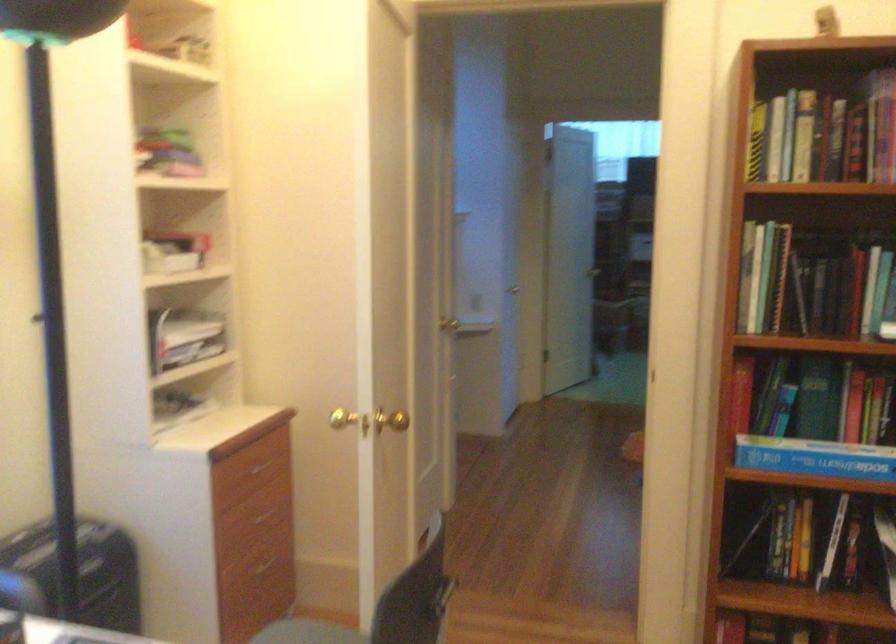
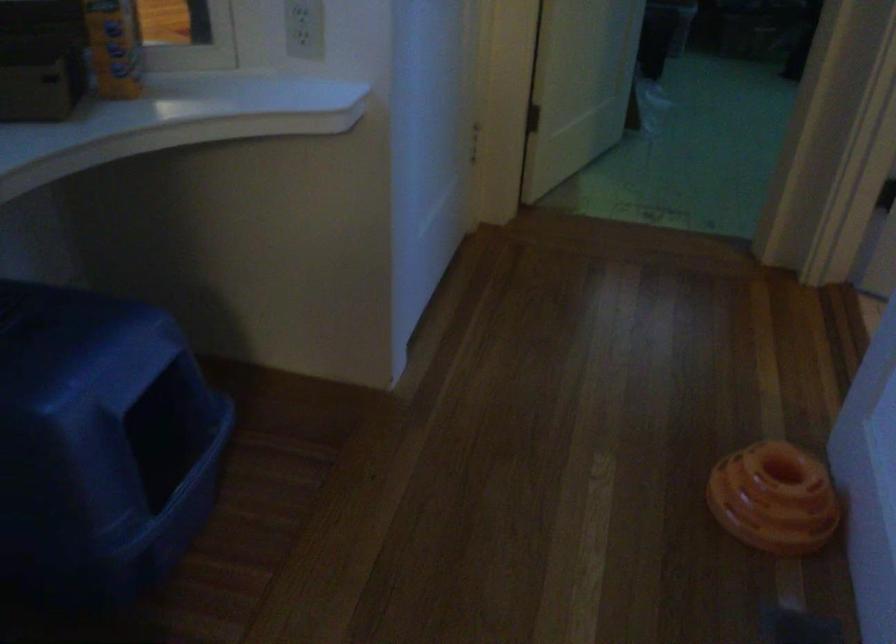
Question: In a continuous first-person perspective shot, in which direction is the camera moving?

Choices:
 (A) Left
 (B) Right
 (C) Forward
 (D) Backward

Answer: (C)